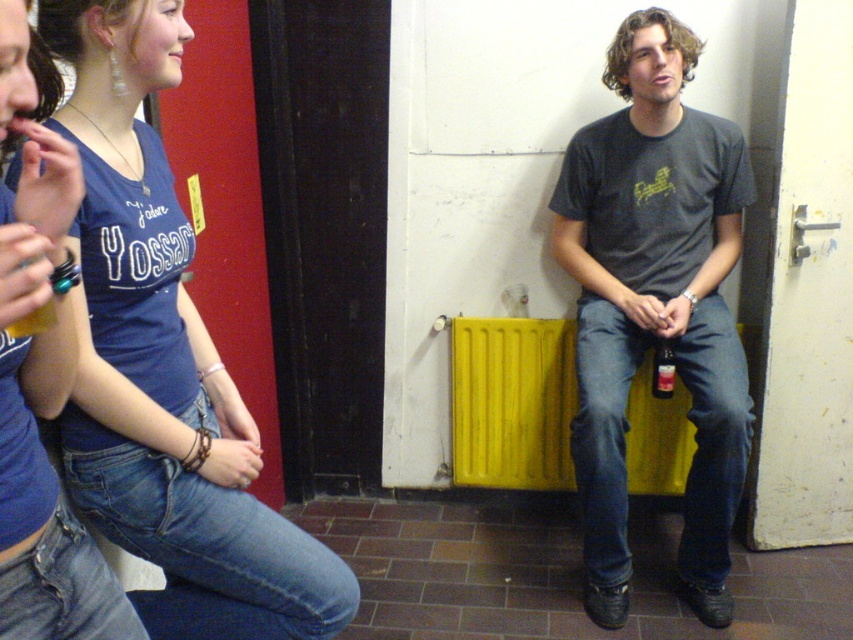
Question: Can you confirm if dark gray t-shirt at center is bigger than translucent glass bottle at center?

Choices:
 (A) no
 (B) yes

Answer: (B)

Question: Which object is positioned farthest from the dark gray t-shirt at center?

Choices:
 (A) blue denim jeans at lower left
 (B) yellow matte radiator at center
 (C) translucent glass bottle at center

Answer: (A)

Question: Which of the following is the farthest from the observer?

Choices:
 (A) dark gray t-shirt at center
 (B) yellow matte radiator at center
 (C) translucent glass bottle at center

Answer: (B)

Question: Is blue denim jeans at lower left positioned in front of translucent glass bottle at center?

Choices:
 (A) yes
 (B) no

Answer: (A)

Question: Is blue denim jeans at lower left further to the viewer compared to dark gray t-shirt at center?

Choices:
 (A) yes
 (B) no

Answer: (B)

Question: Estimate the real-world distances between objects in this image. Which object is farther from the dark gray t-shirt at center?

Choices:
 (A) blue denim jeans at lower left
 (B) translucent glass bottle at center

Answer: (A)